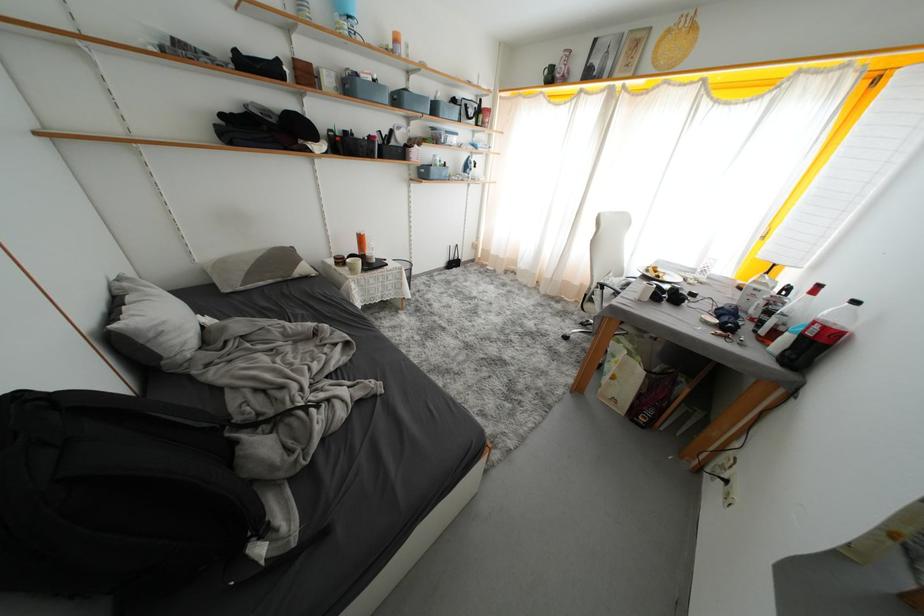
The image size is (924, 616). Identify the location of large soda bottle. (820, 336).